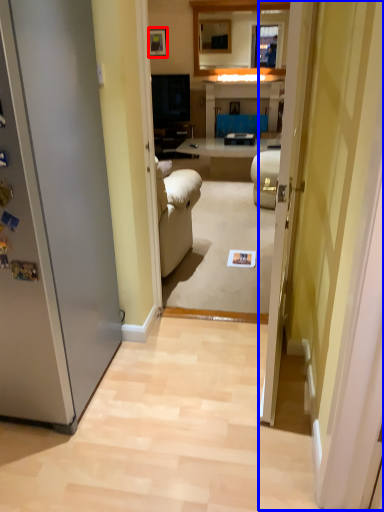
Question: Among these objects, which one is farthest to the camera, picture frame (highlighted by a red box) or glass door (highlighted by a blue box)?

Choices:
 (A) picture frame
 (B) glass door

Answer: (A)